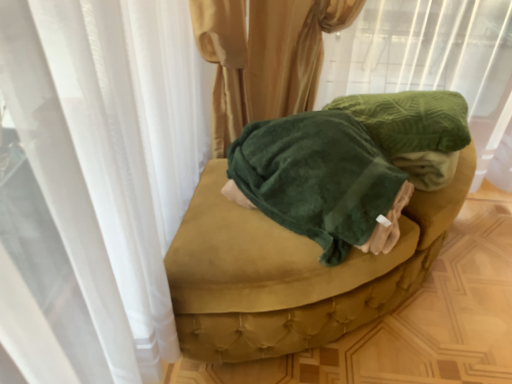
I want to click on velvety green blanket at center, so click(x=319, y=180).

Image resolution: width=512 pixels, height=384 pixels. Find the location of `velvet green ottoman at center`. velvet green ottoman at center is located at coordinates (314, 224).

Is green velvety fabric at upper center facing towards velvety green blanket at center?

No, green velvety fabric at upper center does not turn towards velvety green blanket at center.

Who is bigger, green velvety fabric at upper center or velvety green blanket at center?

Bigger between the two is green velvety fabric at upper center.

Considering the positions of objects green velvety fabric at upper center and velvety green blanket at center in the image provided, who is more to the left, green velvety fabric at upper center or velvety green blanket at center?

velvety green blanket at center.

Looking at this image, are green velvety fabric at upper center and velvety green blanket at center far apart?

green velvety fabric at upper center is near velvety green blanket at center, not far away.

How distant is velvet green ottoman at center from velvety green blanket at center?

The distance of velvet green ottoman at center from velvety green blanket at center is 3.66 inches.

Can you tell me how much velvet green ottoman at center and velvety green blanket at center differ in facing direction?

velvet green ottoman at center and velvety green blanket at center are facing 145 degrees away from each other.

Between velvet green ottoman at center and velvety green blanket at center, which one has less height?

velvet green ottoman at center is shorter.

Would you say velvet green ottoman at center is outside velvety green blanket at center?

Yes.

From a real-world perspective, is velvety green blanket at center located beneath velvet green ottoman at center?

Actually, velvety green blanket at center is physically above velvet green ottoman at center in the real world.

Is velvet green ottoman at center at the back of velvety green blanket at center?

That's not correct — velvety green blanket at center is not looking away from velvet green ottoman at center.

Considering the relative positions of velvety green blanket at center and velvet green ottoman at center in the image provided, is velvety green blanket at center to the left or to the right of velvet green ottoman at center?

Clearly, velvety green blanket at center is on the left of velvet green ottoman at center in the image.

Considering the sizes of velvety green blanket at center and velvet green ottoman at center in the image, is velvety green blanket at center taller or shorter than velvet green ottoman at center?

velvety green blanket at center is taller than velvet green ottoman at center.

Is velvety green blanket at center taller or shorter than green velvety fabric at upper center?

In the image, velvety green blanket at center appears to be shorter than green velvety fabric at upper center.

Identify the location of curtain above the velvety green blanket at center (from the image's perspective). (426, 57).

Is velvety green blanket at center in front of or behind green velvety fabric at upper center in the image?

Visually, velvety green blanket at center is located in front of green velvety fabric at upper center.

Is there a large distance between velvet green ottoman at center and green velvety fabric at upper center?

Result: That's not correct — velvet green ottoman at center is a little close to green velvety fabric at upper center.

Is velvet green ottoman at center bigger or smaller than green velvety fabric at upper center?

Considering their sizes, velvet green ottoman at center takes up less space than green velvety fabric at upper center.

How far apart are velvet green ottoman at center and green velvety fabric at upper center?

A distance of 24.06 inches exists between velvet green ottoman at center and green velvety fabric at upper center.

Is the position of velvet green ottoman at center less distant than that of green velvety fabric at upper center?

No, it is not.

Is velvet green ottoman at center located within green velvety fabric at upper center?

No.

Between green velvety fabric at upper center and velvet green ottoman at center, which one appears on the right side from the viewer's perspective?

green velvety fabric at upper center.

Which object is further away from the camera taking this photo, green velvety fabric at upper center or velvet green ottoman at center?

Positioned behind is velvet green ottoman at center.

This screenshot has width=512, height=384. I want to click on curtain on the right of velvet green ottoman at center, so click(426, 57).

You are a GUI agent. You are given a task and a screenshot of the screen. Output one action in this format:
    pyautogui.click(x=<x>, y=<y>)
    Task: Click on the clothing above the green velvety fabric at upper center (from a real-world perspective)
    The height and width of the screenshot is (384, 512).
    Given the screenshot: What is the action you would take?
    pyautogui.click(x=319, y=180)

Identify the location of furniture on the right of velvety green blanket at center. Image resolution: width=512 pixels, height=384 pixels. (314, 224).

When comparing their distances from green velvety fabric at upper center, does velvet green ottoman at center or velvety green blanket at center seem closer?

velvet green ottoman at center is positioned closer to the anchor green velvety fabric at upper center.

When comparing their distances from green velvety fabric at upper center, does velvety green blanket at center or velvet green ottoman at center seem further?

velvety green blanket at center is positioned further to the anchor green velvety fabric at upper center.

Looking at the image, which one is located further to velvety green blanket at center, velvet green ottoman at center or green velvety fabric at upper center?

green velvety fabric at upper center is positioned further to the anchor velvety green blanket at center.

Based on their spatial positions, is velvety green blanket at center or green velvety fabric at upper center further from velvet green ottoman at center?

Based on the image, green velvety fabric at upper center appears to be further to velvet green ottoman at center.

Which object lies nearer to the anchor point velvet green ottoman at center, green velvety fabric at upper center or velvety green blanket at center?

velvety green blanket at center is positioned closer to the anchor velvet green ottoman at center.

Based on their spatial positions, is green velvety fabric at upper center or velvet green ottoman at center further from velvety green blanket at center?

Among the two, green velvety fabric at upper center is located further to velvety green blanket at center.

I want to click on clothing between green velvety fabric at upper center and velvet green ottoman at center in the up-down direction, so click(x=319, y=180).